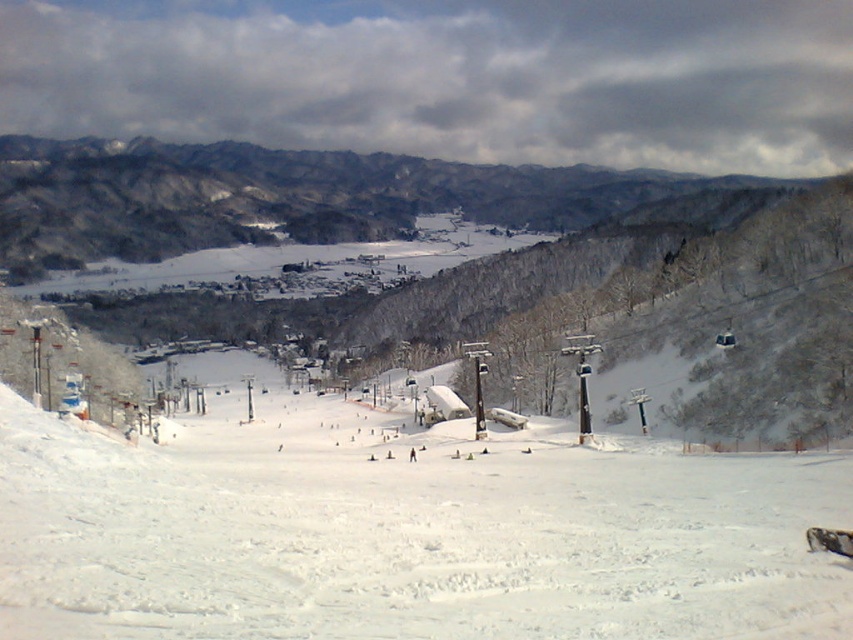
This screenshot has width=853, height=640. I want to click on white snow ski slope at center, so click(x=405, y=541).

Which is behind, point (0, 432) or point (849, 548)?

The point (0, 432) is more distant.

Does point (717, 461) come farther from viewer compared to point (827, 541)?

Yes.

Identify the location of white snow ski slope at center. This screenshot has width=853, height=640. (405, 541).